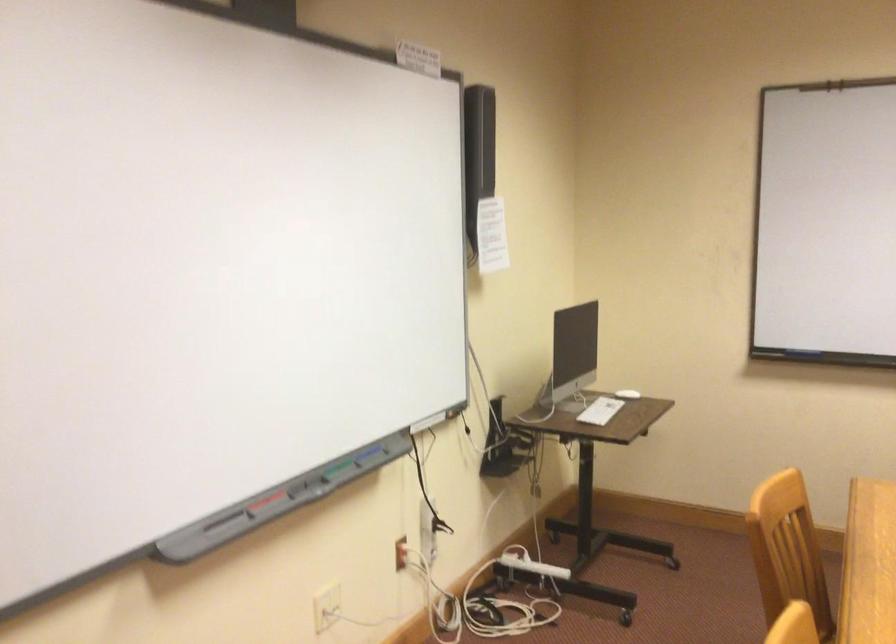
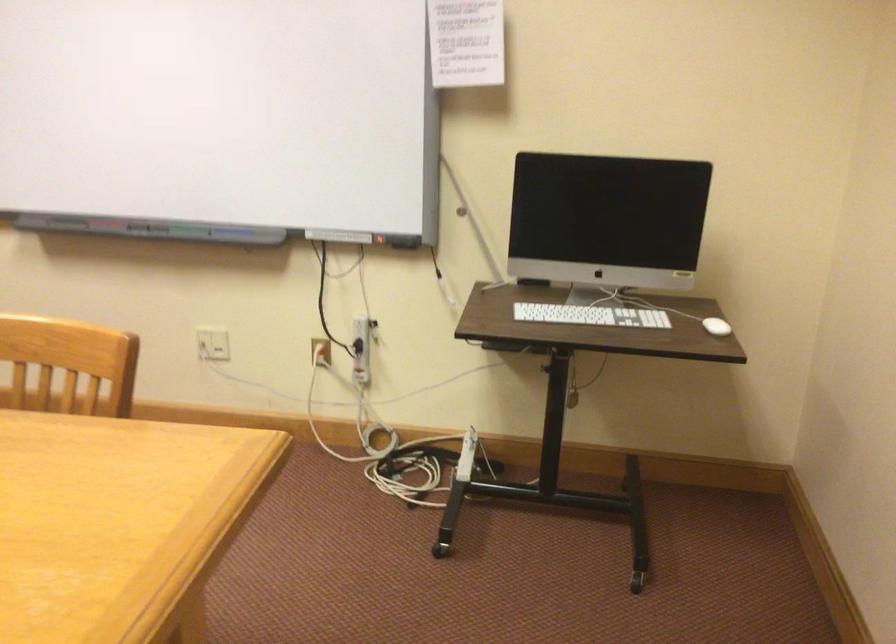
Find the pixel in the second image that matches point (273, 506) in the first image.

(100, 225)